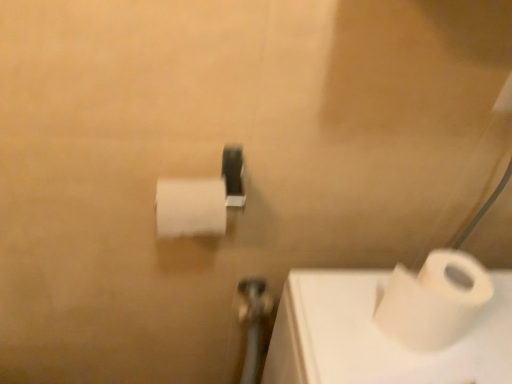
The height and width of the screenshot is (384, 512). I want to click on white matte toilet paper at center, which is the 1th toilet paper from top to bottom, so click(x=191, y=207).

You are a GUI agent. You are given a task and a screenshot of the screen. Output one action in this format:
    pyautogui.click(x=<x>, y=<y>)
    Task: Click on the white matte toilet paper at center, which is the 1th toilet paper from top to bottom
    Image resolution: width=512 pixels, height=384 pixels.
    Given the screenshot: What is the action you would take?
    pyautogui.click(x=191, y=207)

Consider the image. Which of these two, white matte toilet paper at center, which is the 1th toilet paper from top to bottom, or metallic silver shower at center, stands shorter?

white matte toilet paper at center, which is the 1th toilet paper from top to bottom, is shorter.

Is white matte toilet paper at center, positioned as the 2th toilet paper in right-to-left order, to the left or to the right of metallic silver shower at center in the image?

Based on their positions, white matte toilet paper at center, positioned as the 2th toilet paper in right-to-left order, is located to the left of metallic silver shower at center.

From a real-world perspective, is white matte toilet paper at center, positioned as the 2th toilet paper in right-to-left order, over metallic silver shower at center?

Yes, from a real-world perspective, white matte toilet paper at center, positioned as the 2th toilet paper in right-to-left order, is over metallic silver shower at center

Which of these two, white matte toilet paper at center, positioned as the 2th toilet paper in right-to-left order, or metallic silver shower at center, is smaller?

Answer: With smaller size is metallic silver shower at center.

Considering the relative positions of white matte toilet paper at center, which is the 1th toilet paper from top to bottom, and white matte toilet paper at lower right, which is the 1th toilet paper from right to left, in the image provided, is white matte toilet paper at center, which is the 1th toilet paper from top to bottom, in front of white matte toilet paper at lower right, which is the 1th toilet paper from right to left,?

No.

Can you tell me how much white matte toilet paper at center, the 1th toilet paper in the left-to-right sequence, and white matte toilet paper at lower right, which is the 1th toilet paper from right to left, differ in facing direction?

white matte toilet paper at center, the 1th toilet paper in the left-to-right sequence, and white matte toilet paper at lower right, which is the 1th toilet paper from right to left, are facing 2.78 degrees away from each other.

Would you say white matte toilet paper at center, the 1th toilet paper in the left-to-right sequence, is inside or outside white matte toilet paper at lower right, acting as the second toilet paper starting from the top?

white matte toilet paper at center, the 1th toilet paper in the left-to-right sequence, is not inside white matte toilet paper at lower right, acting as the second toilet paper starting from the top, it's outside.

Which is closer to the camera, (215, 198) or (476, 277)?

The point (215, 198) is closer to the camera.

Does metallic silver shower at center have a smaller size compared to white matte toilet paper at lower right, the 1th toilet paper from the bottom?

Yes, metallic silver shower at center is smaller than white matte toilet paper at lower right, the 1th toilet paper from the bottom.

Does metallic silver shower at center turn towards white matte toilet paper at lower right, acting as the second toilet paper starting from the top?

No.

Is metallic silver shower at center at the left side of white matte toilet paper at lower right, the 1th toilet paper from the bottom?

Correct, you'll find metallic silver shower at center to the left of white matte toilet paper at lower right, the 1th toilet paper from the bottom.

From a real-world perspective, which is physically above, metallic silver shower at center or white matte toilet paper at center, which is the 1th toilet paper from top to bottom?

white matte toilet paper at center, which is the 1th toilet paper from top to bottom, from a real-world perspective.

Which object is further away from the camera taking this photo, metallic silver shower at center or white matte toilet paper at center, the 1th toilet paper in the left-to-right sequence?

metallic silver shower at center.

Measure the distance between metallic silver shower at center and white matte toilet paper at center, which is the 1th toilet paper from top to bottom.

metallic silver shower at center and white matte toilet paper at center, which is the 1th toilet paper from top to bottom, are 33.28 centimeters apart from each other.

Between metallic silver shower at center and white matte toilet paper at center, the 1th toilet paper in the left-to-right sequence, which one has more height?

metallic silver shower at center is taller.

Looking at the image, does white matte toilet paper at lower right, the 1th toilet paper from the bottom, seem bigger or smaller compared to metallic silver shower at center?

In the image, white matte toilet paper at lower right, the 1th toilet paper from the bottom, appears to be larger than metallic silver shower at center.

Between white matte toilet paper at lower right, which is the 1th toilet paper from right to left, and metallic silver shower at center, which one is positioned in front?

white matte toilet paper at lower right, which is the 1th toilet paper from right to left, is more forward.

From a real-world perspective, between white matte toilet paper at lower right, which is the 1th toilet paper from right to left, and metallic silver shower at center, who is vertically lower?

metallic silver shower at center, from a real-world perspective.

From the image's perspective, is white matte toilet paper at lower right, marked as the second toilet paper in a left-to-right arrangement, on white matte toilet paper at center, positioned as the 2th toilet paper in bottom-to-top order?

No, from the image's perspective, white matte toilet paper at lower right, marked as the second toilet paper in a left-to-right arrangement, is not over white matte toilet paper at center, positioned as the 2th toilet paper in bottom-to-top order.

Based on their positions, is white matte toilet paper at lower right, which is the 1th toilet paper from right to left, located to the left or right of white matte toilet paper at center, positioned as the 2th toilet paper in bottom-to-top order?

Based on their positions, white matte toilet paper at lower right, which is the 1th toilet paper from right to left, is located to the right of white matte toilet paper at center, positioned as the 2th toilet paper in bottom-to-top order.

The width and height of the screenshot is (512, 384). In the image, there is a white matte toilet paper at lower right, the 1th toilet paper from the bottom. What are the coordinates of `toilet paper above it (from the image's perspective)` in the screenshot? It's located at (191, 207).

How different are the orientations of white matte toilet paper at lower right, which is the 1th toilet paper from right to left, and white matte toilet paper at center, positioned as the 2th toilet paper in bottom-to-top order, in degrees?

white matte toilet paper at lower right, which is the 1th toilet paper from right to left, and white matte toilet paper at center, positioned as the 2th toilet paper in bottom-to-top order, are facing 2.78 degrees away from each other.

I want to click on shower that appears below the white matte toilet paper at center, the 1th toilet paper in the left-to-right sequence (from the image's perspective), so click(254, 325).

The image size is (512, 384). In order to click on toilet paper to the left of white matte toilet paper at lower right, marked as the second toilet paper in a left-to-right arrangement in this screenshot , I will do `click(191, 207)`.

Based on their spatial positions, is metallic silver shower at center or white matte toilet paper at center, positioned as the 2th toilet paper in right-to-left order, further from white matte toilet paper at lower right, acting as the second toilet paper starting from the top?

Based on the image, metallic silver shower at center appears to be further to white matte toilet paper at lower right, acting as the second toilet paper starting from the top.

Estimate the real-world distances between objects in this image. Which object is further from metallic silver shower at center, white matte toilet paper at lower right, which is the 1th toilet paper from right to left, or white matte toilet paper at center, the 1th toilet paper in the left-to-right sequence?

white matte toilet paper at lower right, which is the 1th toilet paper from right to left, is further to metallic silver shower at center.

Estimate the real-world distances between objects in this image. Which object is closer to white matte toilet paper at lower right, the 1th toilet paper from the bottom, white matte toilet paper at center, which is the 1th toilet paper from top to bottom, or metallic silver shower at center?

white matte toilet paper at center, which is the 1th toilet paper from top to bottom, is closer to white matte toilet paper at lower right, the 1th toilet paper from the bottom.

Which object lies further to the anchor point white matte toilet paper at center, which is the 1th toilet paper from top to bottom, white matte toilet paper at lower right, marked as the second toilet paper in a left-to-right arrangement, or metallic silver shower at center?

metallic silver shower at center lies further to white matte toilet paper at center, which is the 1th toilet paper from top to bottom, than the other object.

Based on their spatial positions, is white matte toilet paper at center, positioned as the 2th toilet paper in bottom-to-top order, or white matte toilet paper at lower right, acting as the second toilet paper starting from the top, further from metallic silver shower at center?

white matte toilet paper at lower right, acting as the second toilet paper starting from the top, lies further to metallic silver shower at center than the other object.

In the scene shown: Which object lies nearer to the anchor point white matte toilet paper at center, the 1th toilet paper in the left-to-right sequence, metallic silver shower at center or white matte toilet paper at lower right, marked as the second toilet paper in a left-to-right arrangement?

Among the two, white matte toilet paper at lower right, marked as the second toilet paper in a left-to-right arrangement, is located nearer to white matte toilet paper at center, the 1th toilet paper in the left-to-right sequence.

Locate an element on the screen. shower between white matte toilet paper at center, the 1th toilet paper in the left-to-right sequence, and white matte toilet paper at lower right, which is the 1th toilet paper from right to left, from left to right is located at coordinates (254, 325).